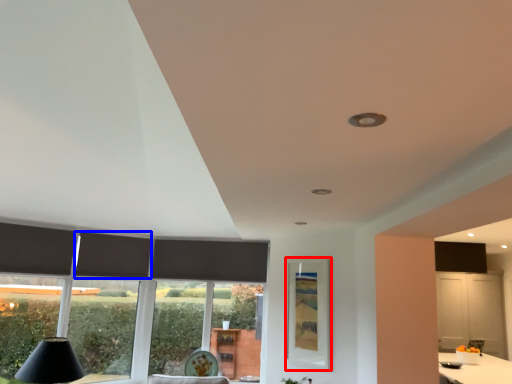
Question: Which of the following is the farthest to the observer, window screen (highlighted by a red box) or curtain (highlighted by a blue box)?

Choices:
 (A) window screen
 (B) curtain

Answer: (B)